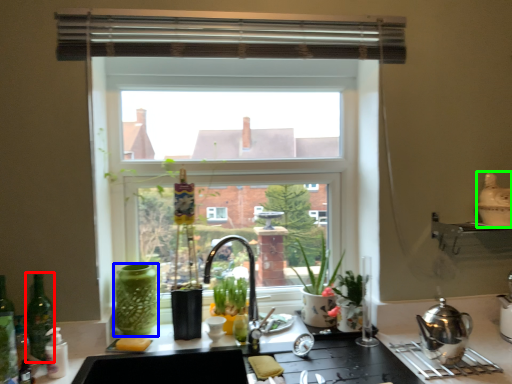
Question: Which object is positioned closest to bottle (highlighted by a red box)? Select from glass vase (highlighted by a blue box) and appliance (highlighted by a green box).

Choices:
 (A) glass vase
 (B) appliance

Answer: (A)